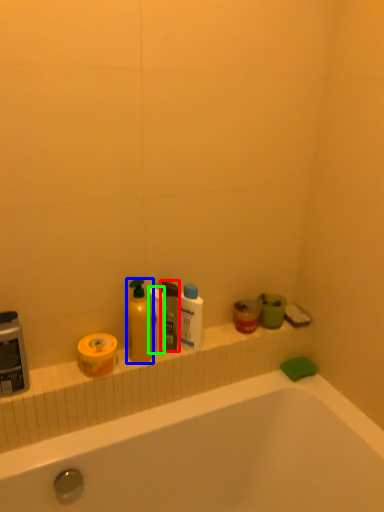
Question: Which object is the closest to the mouthwash (highlighted by a red box)? Choose among these: cleaning product (highlighted by a blue box) or toilet paper (highlighted by a green box).

Choices:
 (A) cleaning product
 (B) toilet paper

Answer: (B)